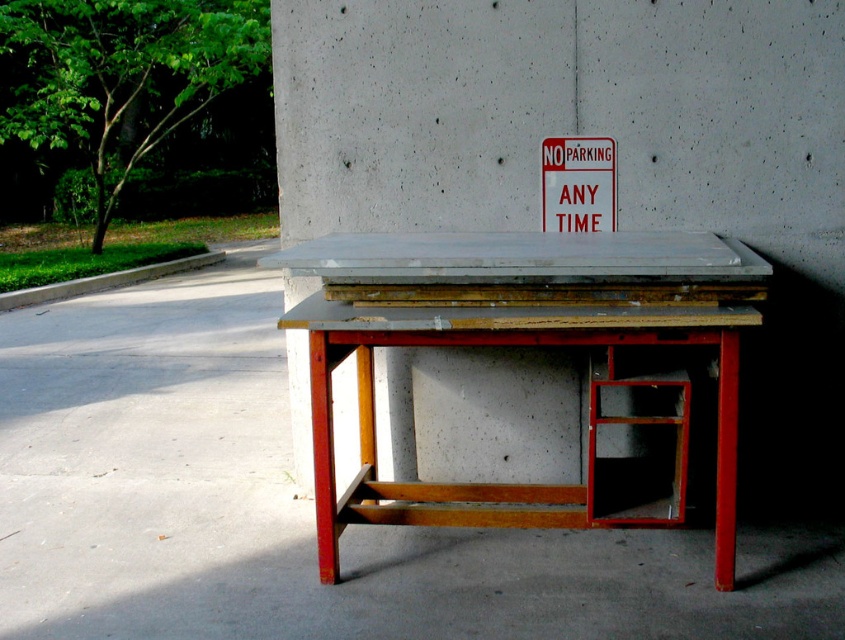
Does point (459, 352) come farther from viewer compared to point (574, 172)?

Yes, it is behind point (574, 172).

Which is in front, point (800, 97) or point (563, 193)?

Point (800, 97) is in front.

Who is more forward, [636,93] or [608,209]?

Positioned in front is point [636,93].

The image size is (845, 640). I want to click on smooth concrete pillar at center, so (592, 134).

Who is shorter, wooden table at center or white plastic sign at upper center?

white plastic sign at upper center is shorter.

Is wooden table at center behind white plastic sign at upper center?

That is False.

Find the location of a particular element. This screenshot has height=640, width=845. wooden table at center is located at coordinates (510, 346).

In the scene shown: Is smooth concrete pillar at center further to camera compared to wooden table at center?

Yes, smooth concrete pillar at center is further from the viewer.

Between smooth concrete pillar at center and wooden table at center, which one appears on the right side from the viewer's perspective?

From the viewer's perspective, smooth concrete pillar at center appears more on the right side.

Is point (424, 81) more distant than point (612, 260)?

Yes, it is behind point (612, 260).

Identify the location of smooth concrete pillar at center. The image size is (845, 640). (592, 134).